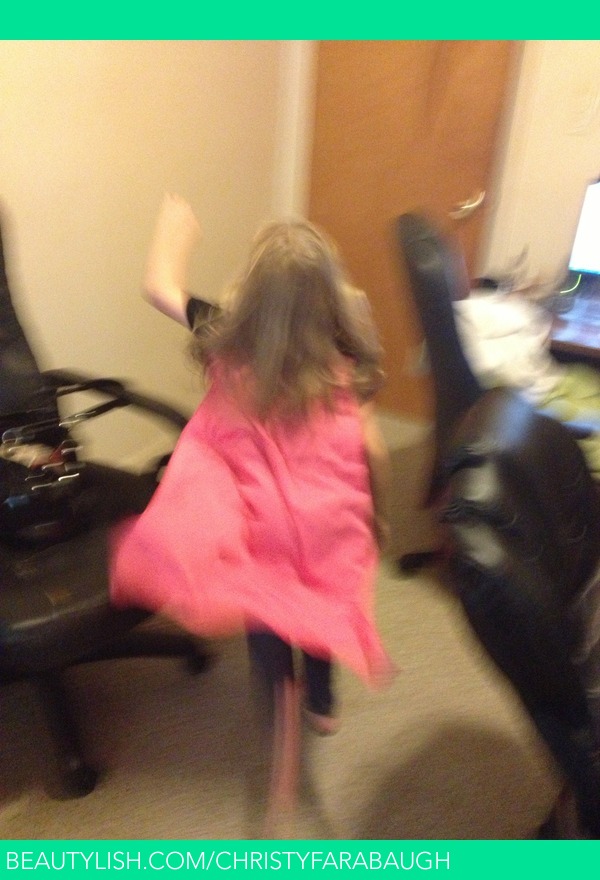
Locate an element on the screen. beige colored wall is located at coordinates (167, 107), (563, 106).